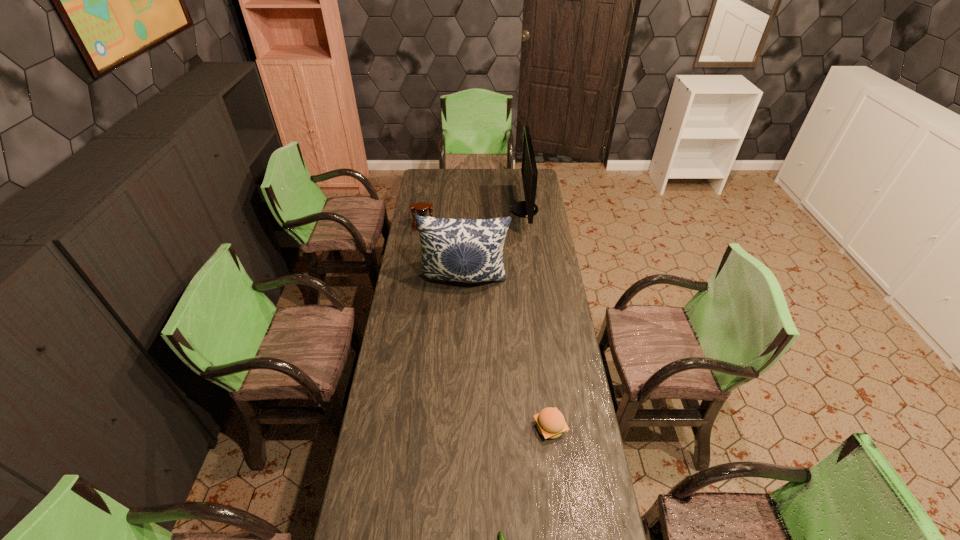
I want to click on vacant region located 0.360m on the back of the fourth tallest object, so click(539, 334).

The height and width of the screenshot is (540, 960). Find the location of `object that is at the far edge`. object that is at the far edge is located at coordinates (528, 208).

The width and height of the screenshot is (960, 540). Find the location of `cushion situated at the left edge`. cushion situated at the left edge is located at coordinates (465, 250).

This screenshot has width=960, height=540. I want to click on hourglass that is positioned at the left edge, so click(x=421, y=208).

Where is `computer monitor located at the right edge`? This screenshot has height=540, width=960. computer monitor located at the right edge is located at coordinates (528, 208).

This screenshot has height=540, width=960. Find the location of `hamburger at the right edge`. hamburger at the right edge is located at coordinates (551, 424).

Image resolution: width=960 pixels, height=540 pixels. I want to click on object located in the far right corner section of the desktop, so click(528, 208).

Identify the location of vacant space at the far edge. (450, 168).

Where is `free space at the left edge of the desktop`? free space at the left edge of the desktop is located at coordinates pos(417,281).

The height and width of the screenshot is (540, 960). I want to click on vacant area at the right edge, so click(x=565, y=319).